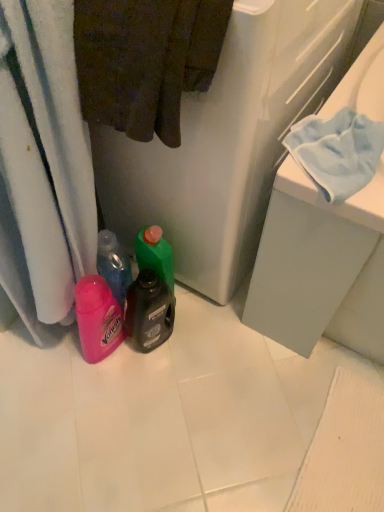
Question: Do you think white plastic laundry at center is within brown cotton towel at upper left, or outside of it?

Choices:
 (A) outside
 (B) inside

Answer: (A)

Question: From a real-world perspective, is white plastic laundry at center physically located above or below brown cotton towel at upper left?

Choices:
 (A) above
 (B) below

Answer: (B)

Question: Is white plastic laundry at center to the left or to the right of brown cotton towel at upper left in the image?

Choices:
 (A) left
 (B) right

Answer: (B)

Question: Considering the positions of brown cotton towel at upper left and white plastic laundry at center in the image, is brown cotton towel at upper left wider or thinner than white plastic laundry at center?

Choices:
 (A) wide
 (B) thin

Answer: (B)

Question: Which is correct: brown cotton towel at upper left is inside white plastic laundry at center, or outside of it?

Choices:
 (A) outside
 (B) inside

Answer: (B)

Question: In the image, is brown cotton towel at upper left positioned in front of or behind white plastic laundry at center?

Choices:
 (A) behind
 (B) front

Answer: (B)

Question: From the image's perspective, is brown cotton towel at upper left positioned above or below white plastic laundry at center?

Choices:
 (A) below
 (B) above

Answer: (A)